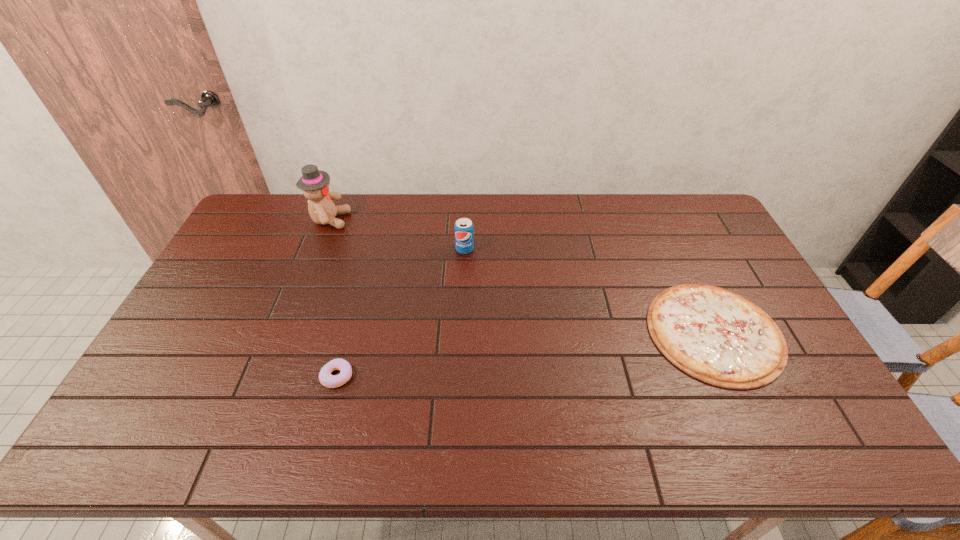
This screenshot has height=540, width=960. In order to click on the leftmost object in this screenshot , I will do `click(314, 183)`.

The height and width of the screenshot is (540, 960). I want to click on rag_doll, so click(x=314, y=183).

At what (x,y) coordinates should I click in order to perform the action: click on soda can. Please return your answer as a coordinate pair (x, y). The height and width of the screenshot is (540, 960). Looking at the image, I should click on (464, 241).

Locate an element on the screen. The image size is (960, 540). the third object from left to right is located at coordinates (464, 241).

At what (x,y) coordinates should I click in order to perform the action: click on doughnut. Please return your answer as a coordinate pair (x, y). This screenshot has width=960, height=540. Looking at the image, I should click on (331, 381).

Locate an element on the screen. The image size is (960, 540). the third object from right to left is located at coordinates (331, 381).

Find the location of `the rightmost object`. the rightmost object is located at coordinates (717, 336).

This screenshot has height=540, width=960. Find the location of `the shortest object`. the shortest object is located at coordinates (717, 336).

Identify the location of vacant region located 0.240m on the front-facing side of the farthest object. (415, 220).

The width and height of the screenshot is (960, 540). I want to click on vacant space located 0.090m on the back of the second tallest object, so click(466, 227).